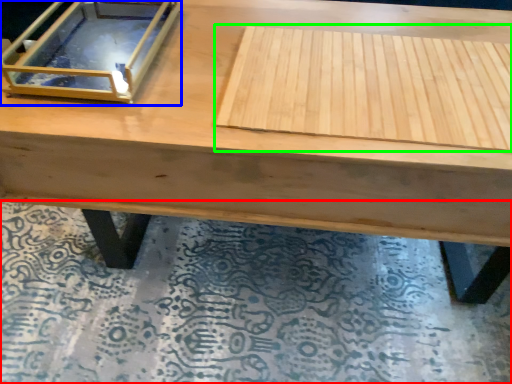
Question: Which object is positioned closest to mat (highlighted by a red box)? Select from glass box (highlighted by a blue box) and plywood (highlighted by a green box).

Choices:
 (A) glass box
 (B) plywood

Answer: (B)